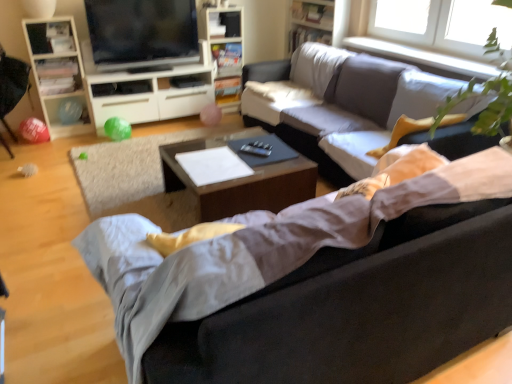
Locate an element on the screen. free space above white matte sheet at center (from a real-world perspective) is located at coordinates (214, 161).